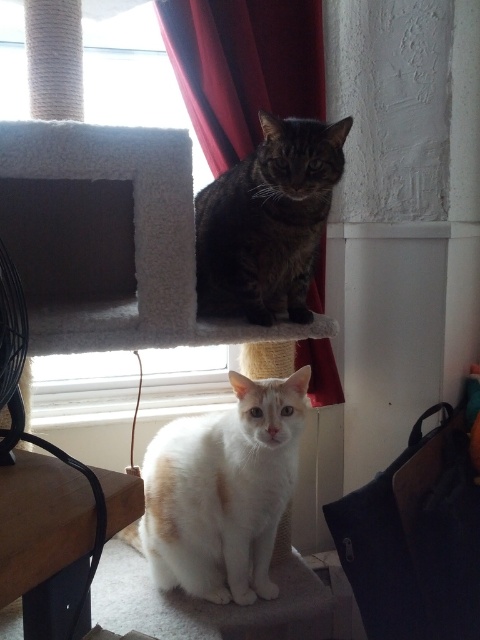
Question: Is white fluffy cat at lower center above red velvet curtain at upper center?

Choices:
 (A) yes
 (B) no

Answer: (B)

Question: Which point appears closest to the camera in this image?

Choices:
 (A) (230, 236)
 (B) (179, 40)

Answer: (A)

Question: Does red velvet curtain at upper center come behind tabby fur cat at upper center?

Choices:
 (A) no
 (B) yes

Answer: (B)

Question: Which point appears farthest from the camera in this image?

Choices:
 (A) (240, 484)
 (B) (312, 294)

Answer: (B)

Question: Which point is closer to the camera?

Choices:
 (A) (220, 76)
 (B) (167, 518)
 (C) (251, 227)

Answer: (C)

Question: In this image, where is white fluffy cat at lower center located relative to red velvet curtain at upper center?

Choices:
 (A) above
 (B) below

Answer: (B)